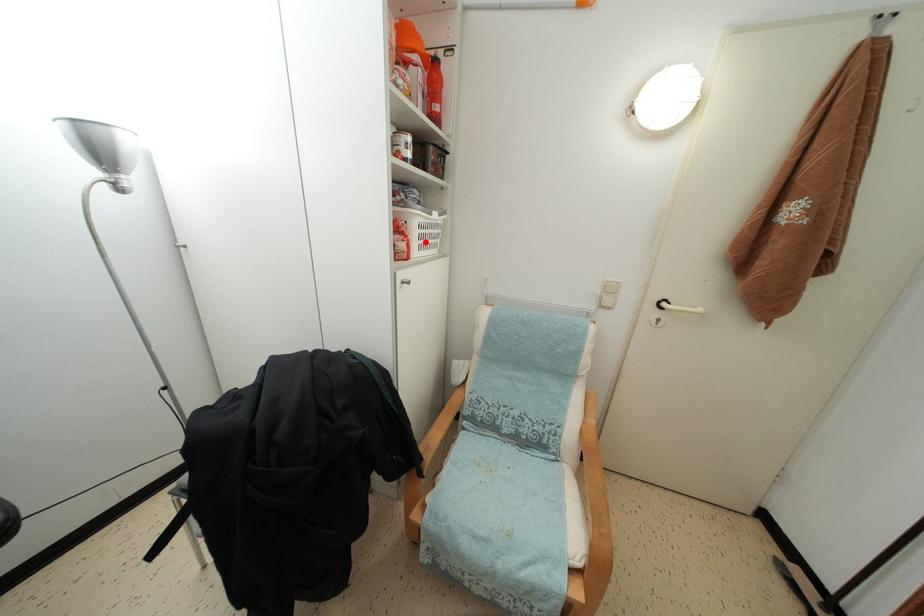
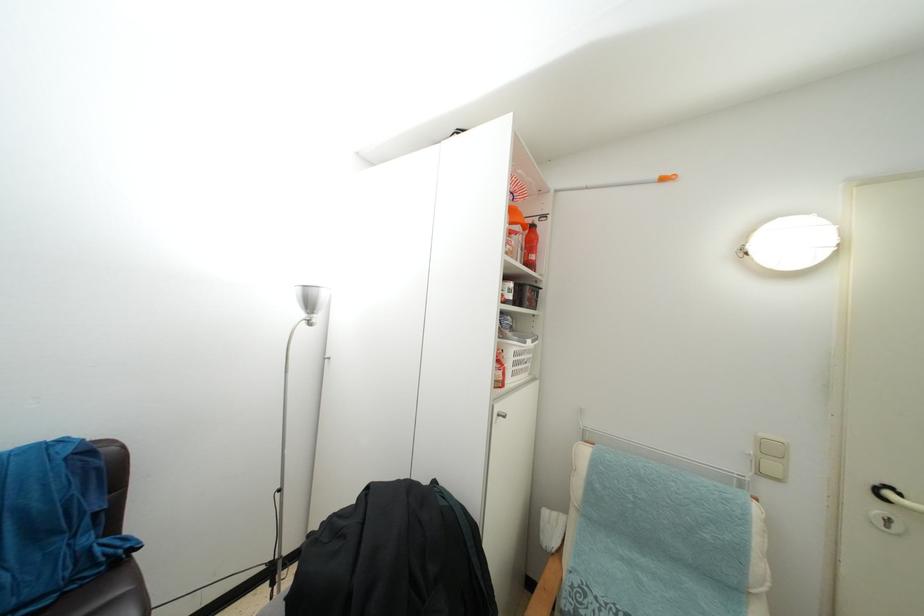
Find the pixel in the second image that matches the highlighted location in the first image.

(519, 370)